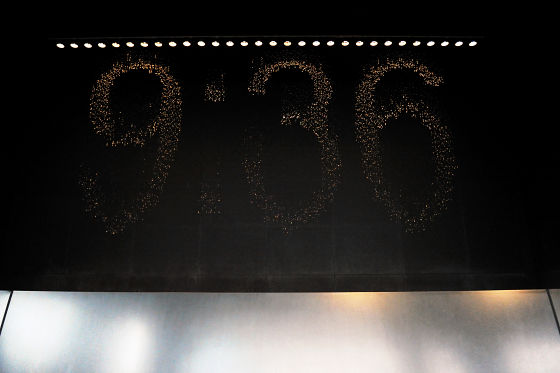
What are the coordinates of `strip of lights` in the screenshot? It's located at click(256, 44).